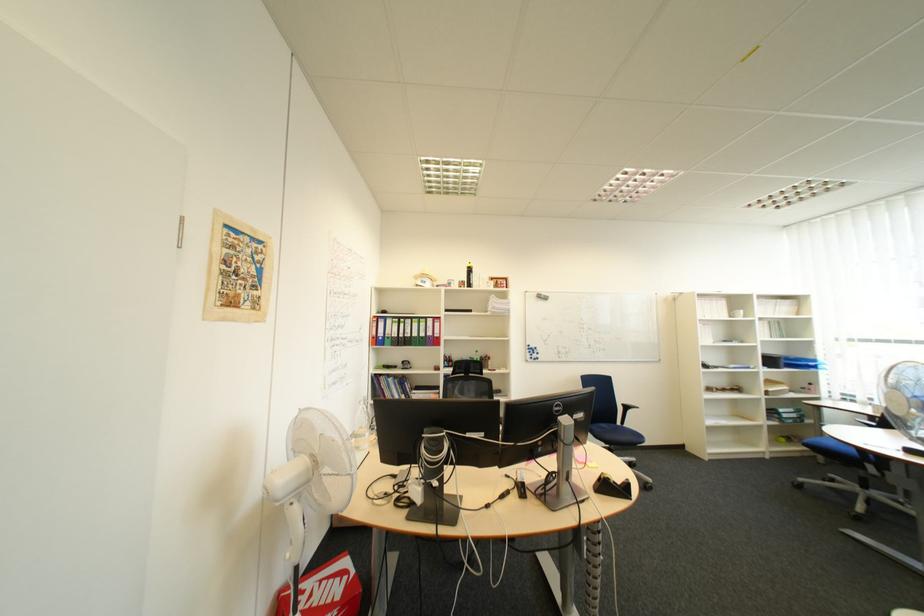
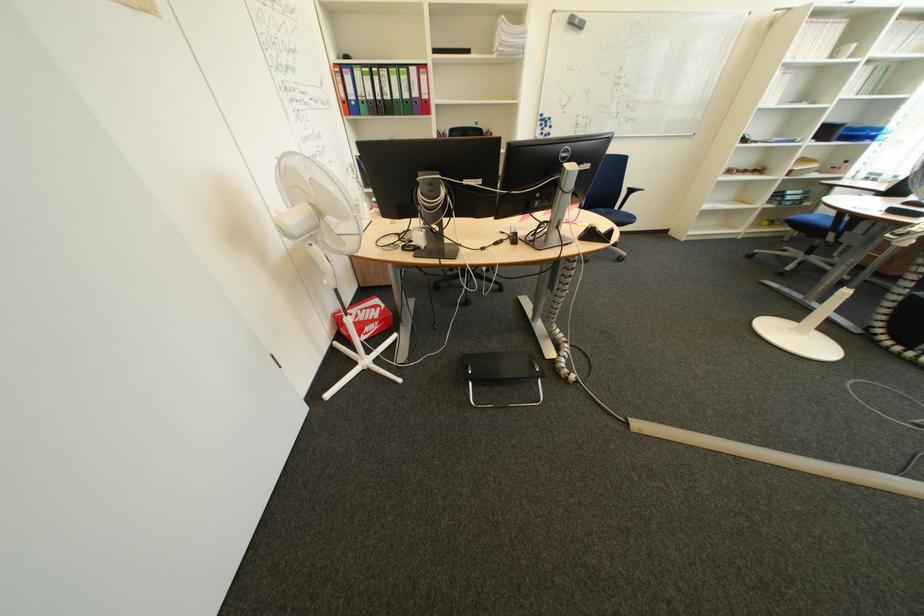
The point at (551, 300) is marked in the first image. Where is the corresponding point in the second image?

(581, 28)